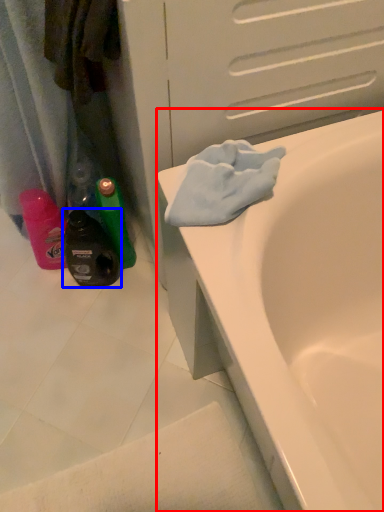
Question: Which object appears closest to the camera in this image, bathtub (highlighted by a red box) or bottle (highlighted by a blue box)?

Choices:
 (A) bathtub
 (B) bottle

Answer: (A)